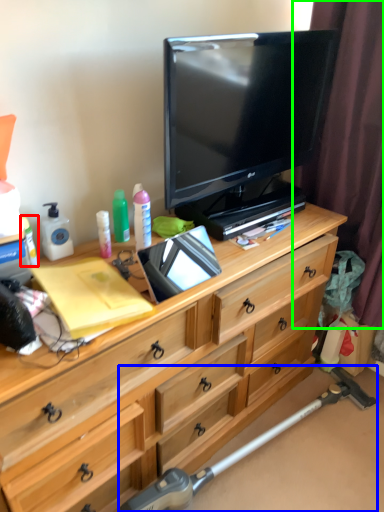
Question: Which is nearer to the toiletry (highlighted by a red box)? equipment (highlighted by a blue box) or curtain (highlighted by a green box).

Choices:
 (A) equipment
 (B) curtain

Answer: (A)